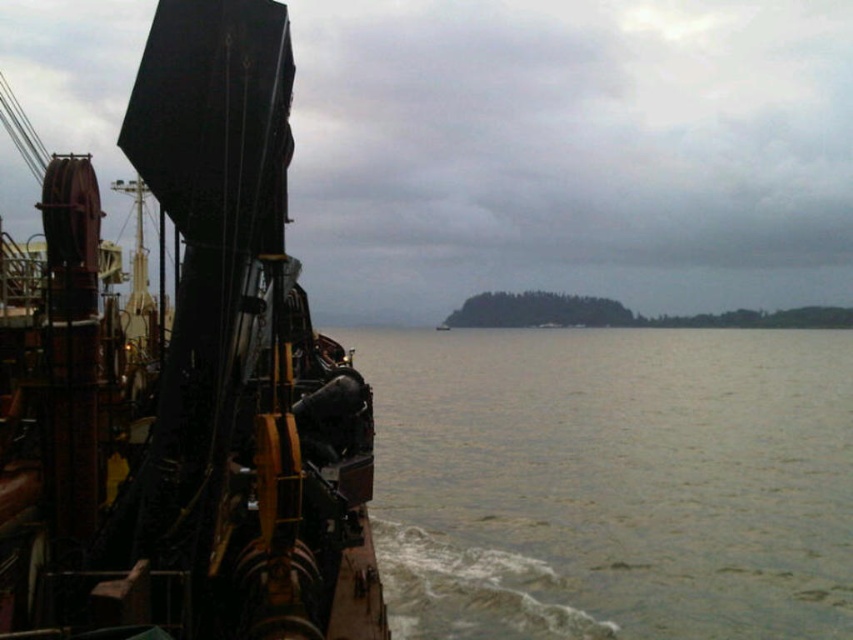
Who is more distant from viewer, (x=143, y=358) or (x=766, y=348)?

Point (x=766, y=348)

Is metallic sheen ship at left further to the viewer compared to greenish water at lower left?

No, metallic sheen ship at left is closer to the viewer.

Is point (206, 124) closer to camera compared to point (637, 598)?

Yes, point (206, 124) is in front of point (637, 598).

The image size is (853, 640). What are the coordinates of `metallic sheen ship at left` in the screenshot? It's located at (183, 380).